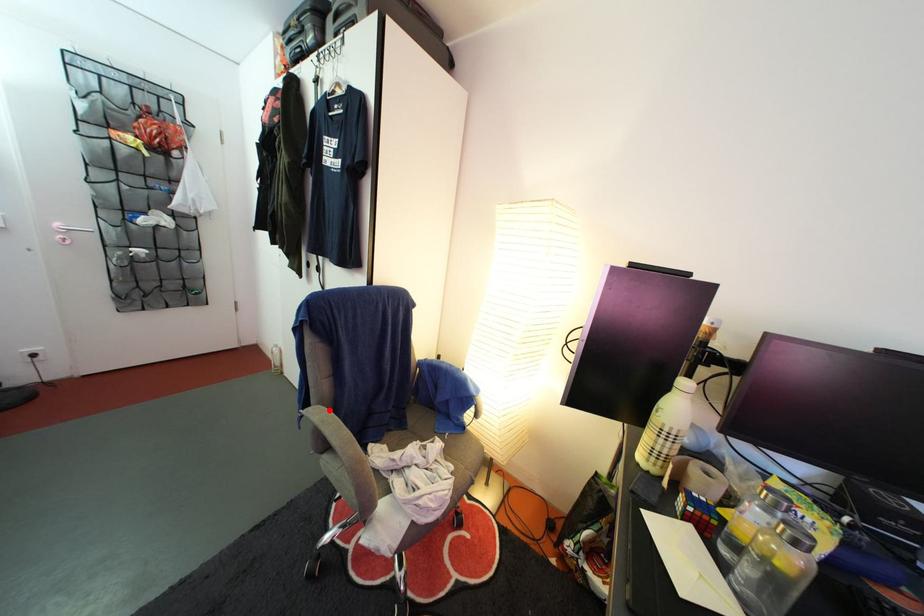
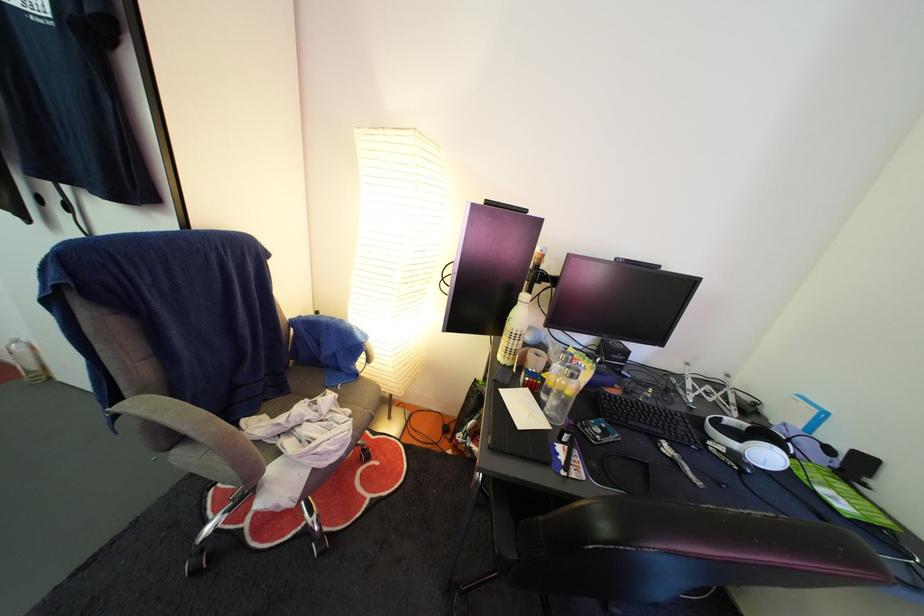
The point at the highlighted location is marked in the first image. Where is the corresponding point in the second image?

(152, 400)